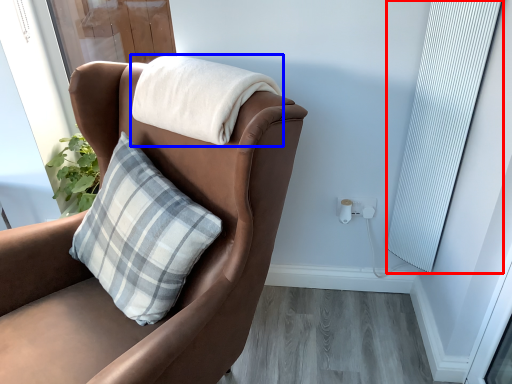
Question: Which of the following is the closest to the observer, curtain (highlighted by a red box) or blanket (highlighted by a blue box)?

Choices:
 (A) curtain
 (B) blanket

Answer: (B)